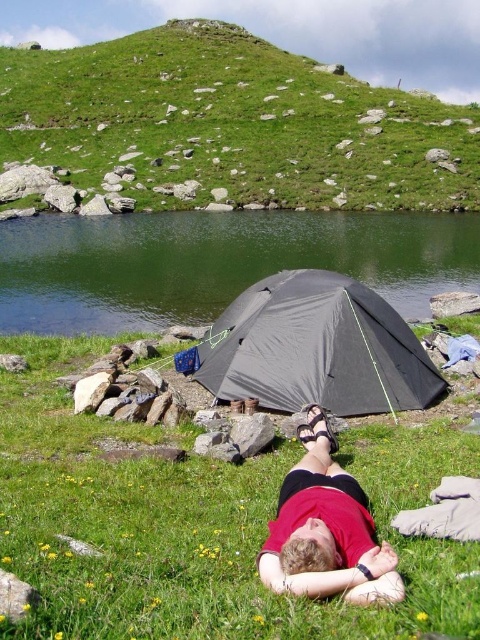
You are planning to set up a tent in the camping area shown. You see the green smooth water at center and the dark gray fabric tent at center. Which object is higher up in the image?

The green smooth water at center is much taller as dark gray fabric tent at center, so the green smooth water at center is higher up in the image.

You are a drone operator trying to capture a photo of the camping scene. The camera is currently positioned at point A. You need to adjust the camera to focus on the green grass at upper center. What coordinate should you move the camera to?

The green grass at upper center is located at coordinate point (231,124), so you should move the camera to that coordinate to focus on it.